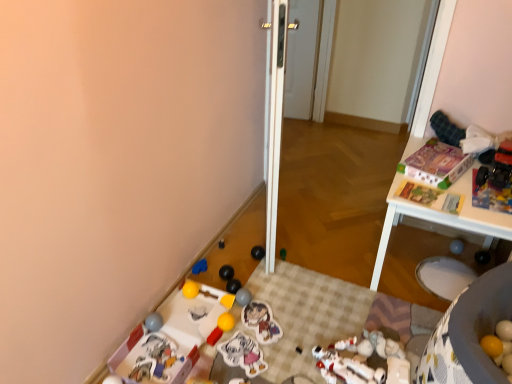
Identify the location of free space to the left of white matte robot at lower center, the 15th toy viewed from the left. This screenshot has height=384, width=512. (284, 354).